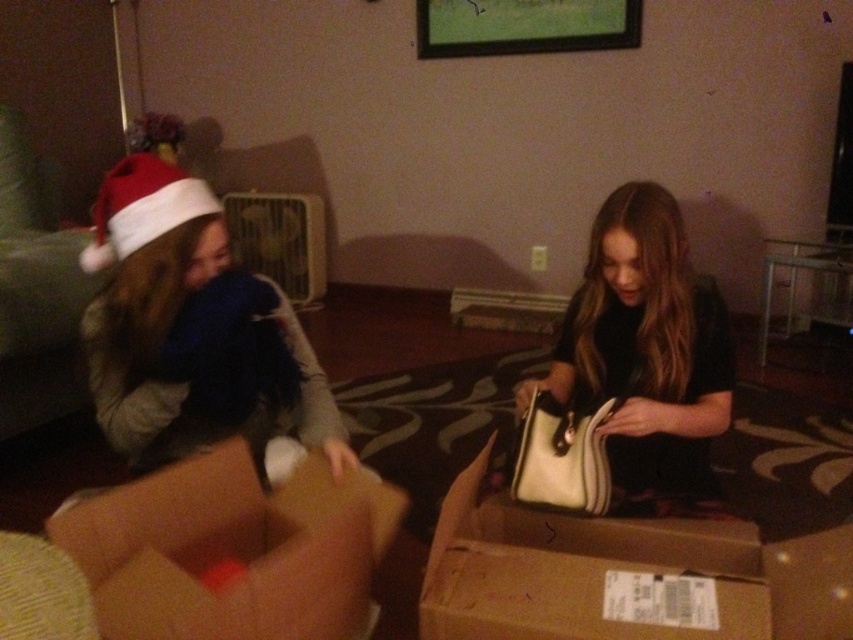
Based on the photo, is matte white plush at left below red velvet santa hat at upper left?

Yes, matte white plush at left is below red velvet santa hat at upper left.

Is matte white plush at left to the right of red velvet santa hat at upper left from the viewer's perspective?

Correct, you'll find matte white plush at left to the right of red velvet santa hat at upper left.

Who is more forward, (157, 285) or (94, 221)?

Point (157, 285) is in front.

This screenshot has width=853, height=640. Identify the location of matte white plush at left. (190, 330).

Who is more distant from viewer, (840, 570) or (300, 541)?

Positioned behind is point (840, 570).

Who is more forward, [515,564] or [358,604]?

Point [515,564] is in front.

Which is behind, point (532, 580) or point (171, 573)?

The point (532, 580) is more distant.

Where is `brown cardboard box at lower right`? brown cardboard box at lower right is located at coordinates (624, 576).

Who is higher up, brown cardboard box at lower left or red velvet santa hat at upper left?

red velvet santa hat at upper left

Can you confirm if brown cardboard box at lower left is positioned above red velvet santa hat at upper left?

Actually, brown cardboard box at lower left is below red velvet santa hat at upper left.

The image size is (853, 640). Identify the location of brown cardboard box at lower left. (231, 548).